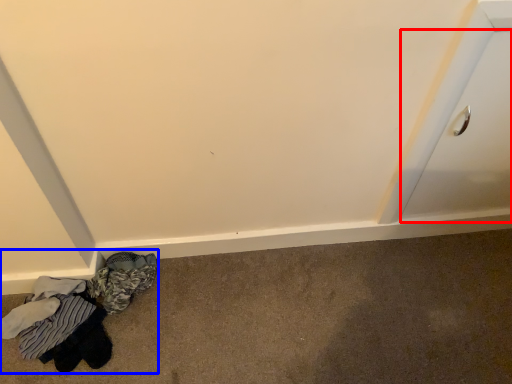
Question: Which point is closer to the camera, drawer (highlighted by a red box) or laundry (highlighted by a blue box)?

Choices:
 (A) drawer
 (B) laundry

Answer: (A)